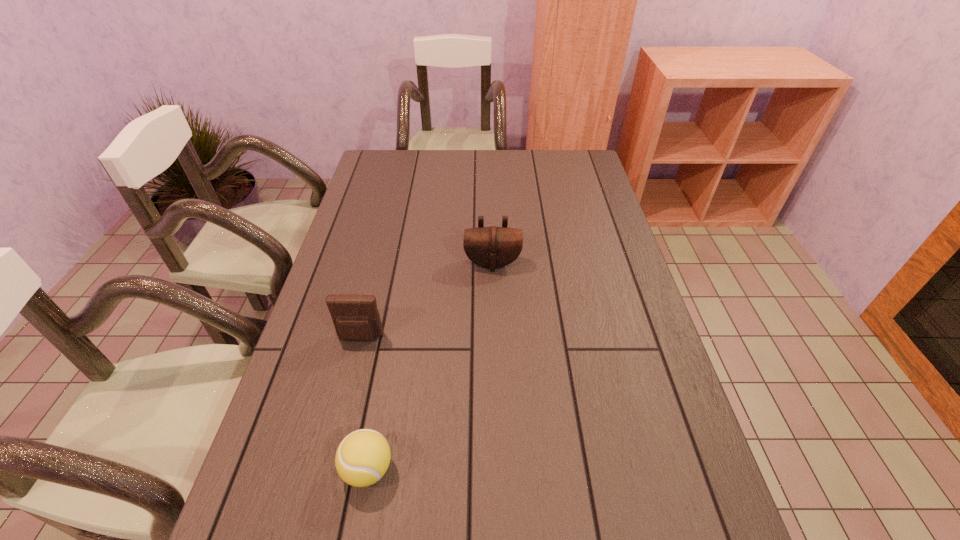
Identify the location of the rightmost object. (492, 247).

Image resolution: width=960 pixels, height=540 pixels. In order to click on the right pouch in this screenshot , I will do `click(492, 247)`.

Where is `the left pouch`? the left pouch is located at coordinates (355, 317).

Where is `the second nearest object`? The image size is (960, 540). the second nearest object is located at coordinates (355, 317).

Where is `the shortest object`? This screenshot has width=960, height=540. the shortest object is located at coordinates (362, 458).

Find the location of a particular element. The height and width of the screenshot is (540, 960). the nearest object is located at coordinates (362, 458).

Where is `vacant space situated with the flap open on the right pouch`? The image size is (960, 540). vacant space situated with the flap open on the right pouch is located at coordinates (494, 336).

Locate an element on the screen. The height and width of the screenshot is (540, 960). vacant area situated 0.350m with an open flap on the nearer pouch is located at coordinates (322, 493).

Where is `free space located 0.060m on the right of the shortest object`? The image size is (960, 540). free space located 0.060m on the right of the shortest object is located at coordinates (424, 469).

This screenshot has width=960, height=540. What are the coordinates of `object positioned at the left edge` in the screenshot? It's located at (355, 317).